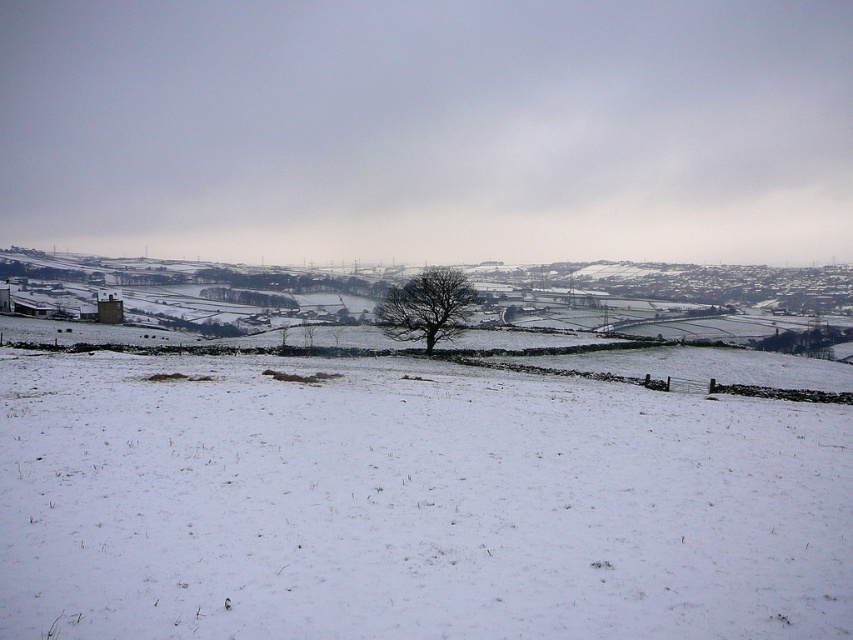
Who is more distant from viewer, (704, 467) or (448, 296)?

The point (448, 296) is more distant.

Does point (770, 490) come behind point (398, 333)?

No, it is not.

Between point (582, 538) and point (450, 300), which one is positioned in front?

Point (582, 538) is in front.

Where is `white powdery snow at center`? The image size is (853, 640). white powdery snow at center is located at coordinates (410, 504).